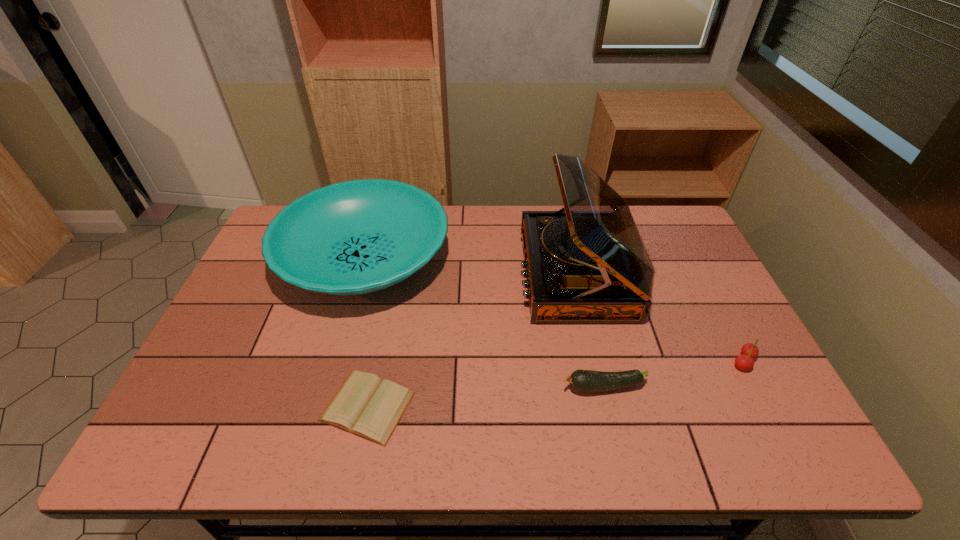
In order to click on record player in this screenshot , I will do [x=587, y=263].

Find the location of a particular element. The width and height of the screenshot is (960, 540). the fourth shortest object is located at coordinates (355, 237).

Identify the location of the third shortest object. (749, 351).

Find the location of a particular element. This screenshot has width=960, height=540. the rightmost object is located at coordinates (749, 351).

The height and width of the screenshot is (540, 960). Identify the location of zucchini. (587, 381).

Find the location of `the shortest object`. the shortest object is located at coordinates (366, 406).

The height and width of the screenshot is (540, 960). I want to click on vacant space located on the front-facing side of the tallest object, so click(x=481, y=274).

Where is `free space located 0.110m on the front-facing side of the tallest object`? free space located 0.110m on the front-facing side of the tallest object is located at coordinates (485, 274).

At what (x,y) coordinates should I click in order to perform the action: click on blank space located 0.270m on the front-facing side of the tallest object. Please return your answer as a coordinate pair (x, y). Looking at the image, I should click on (433, 274).

Identify the location of free space located on the front of the second tallest object. Image resolution: width=960 pixels, height=540 pixels. (341, 344).